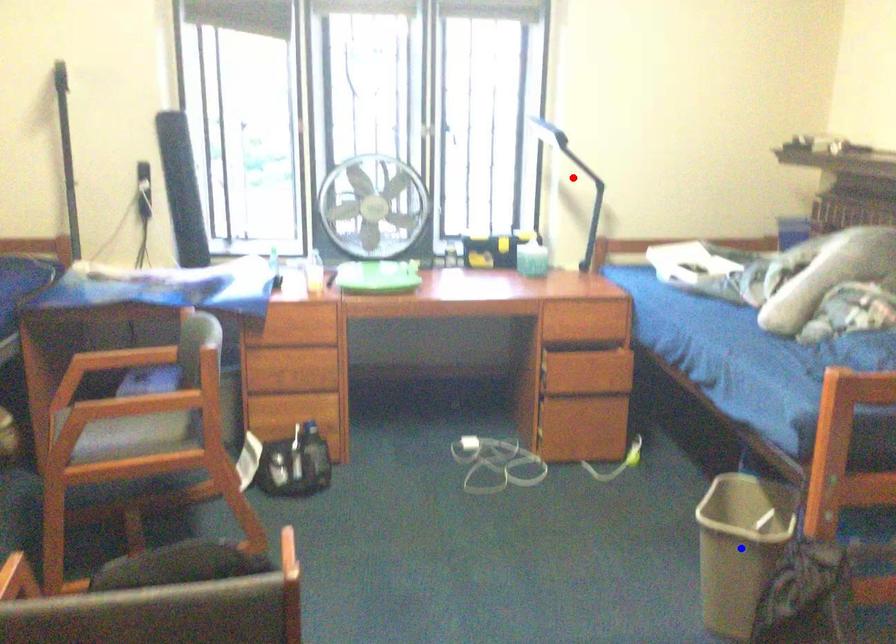
Question: In the image, two points are highlighted. Which point is nearer to the camera? Reply with the corresponding letter.

Choices:
 (A) blue point
 (B) red point

Answer: (A)